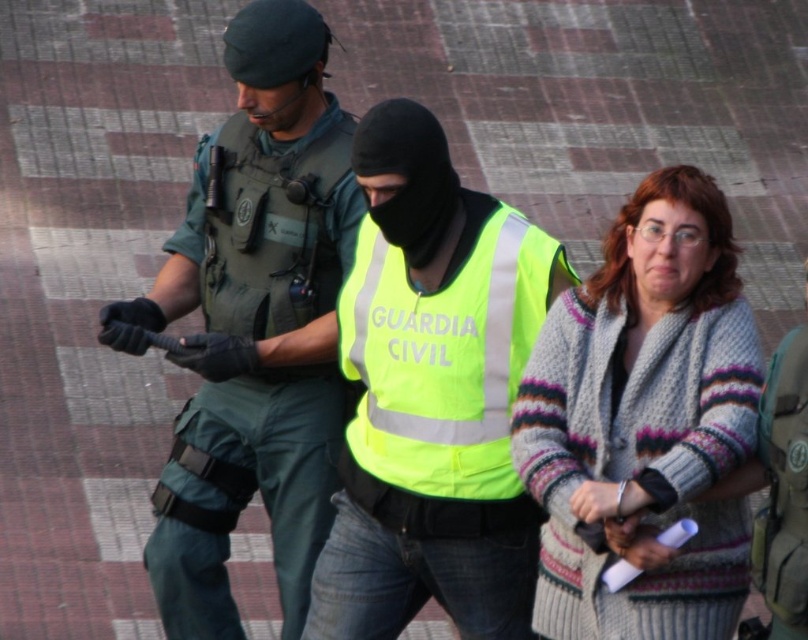
Question: Which point is farther to the camera?

Choices:
 (A) (386, 403)
 (B) (287, 436)
 (C) (687, 204)

Answer: (B)

Question: From the image, what is the correct spatial relationship of knitted sweater at center in relation to neon yellow reflective vest at center?

Choices:
 (A) right
 (B) left

Answer: (A)

Question: Which of the following is the farthest from the observer?

Choices:
 (A) neon yellow reflective vest at center
 (B) green tactical vest at center
 (C) knitted sweater at center

Answer: (A)

Question: Which object is the farthest from the green tactical vest at center?

Choices:
 (A) knitted sweater at center
 (B) neon yellow reflective vest at center

Answer: (A)

Question: Does green tactical vest at center come in front of neon yellow reflective vest at center?

Choices:
 (A) no
 (B) yes

Answer: (B)

Question: Is knitted sweater at center smaller than neon yellow reflective vest at center?

Choices:
 (A) yes
 (B) no

Answer: (B)